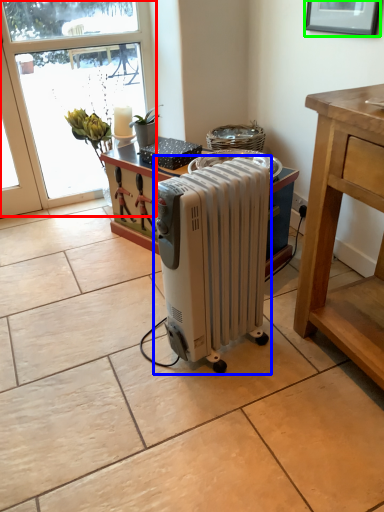
Question: Which object is positioned farthest from window (highlighted by a red box)? Select from home appliance (highlighted by a blue box) and picture frame (highlighted by a green box).

Choices:
 (A) home appliance
 (B) picture frame

Answer: (A)